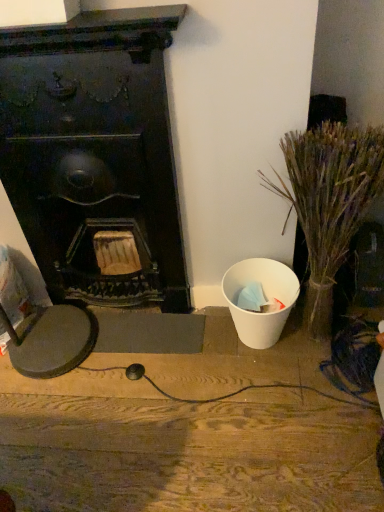
At what (x,y) coordinates should I click in order to perform the action: click on vacant region above white matte trash can at right (from a real-world perspective). Please return your answer as a coordinate pair (x, y). The height and width of the screenshot is (512, 384). Looking at the image, I should click on (128, 394).